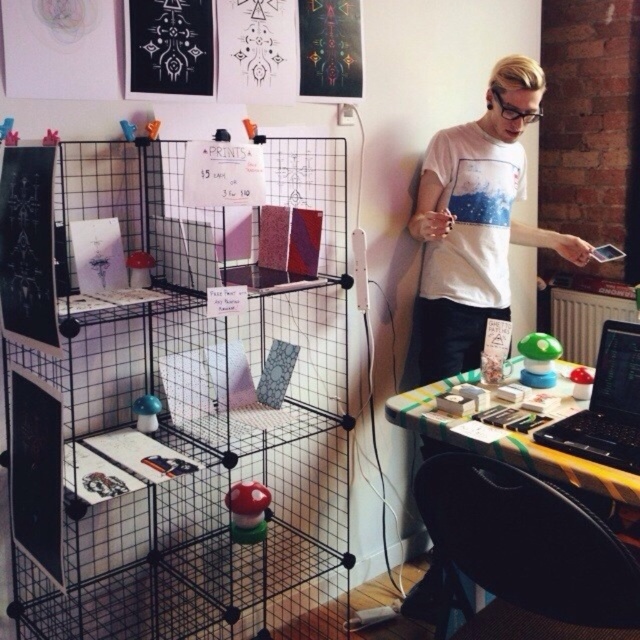
Is black wire mesh cage at center shorter than black plastic laptop at right?

No, black wire mesh cage at center is not shorter than black plastic laptop at right.

Consider the image. Is black wire mesh cage at center positioned at the back of black plastic laptop at right?

No, it is in front of black plastic laptop at right.

Does point (164, 538) come closer to viewer compared to point (625, 362)?

That is False.

Image resolution: width=640 pixels, height=640 pixels. Identify the location of black wire mesh cage at center. (172, 390).

Who is higher up, black plastic laptop at right or yellow checkered table at lower right?

black plastic laptop at right is above.

Does black plastic laptop at right have a lesser height compared to yellow checkered table at lower right?

In fact, black plastic laptop at right may be taller than yellow checkered table at lower right.

Describe the element at coordinates (605, 404) in the screenshot. I see `black plastic laptop at right` at that location.

Locate an element on the screen. The height and width of the screenshot is (640, 640). black plastic laptop at right is located at coordinates (605, 404).

Can you confirm if black wire mesh cage at center is positioned above white matte t-shirt at center?

Incorrect, black wire mesh cage at center is not positioned above white matte t-shirt at center.

Between black wire mesh cage at center and white matte t-shirt at center, which one appears on the right side from the viewer's perspective?

white matte t-shirt at center is more to the right.

Who is more distant from viewer, (72,609) or (456,202)?

Point (456,202)

Find the location of a particular element. The image size is (640, 640). black wire mesh cage at center is located at coordinates (x=172, y=390).